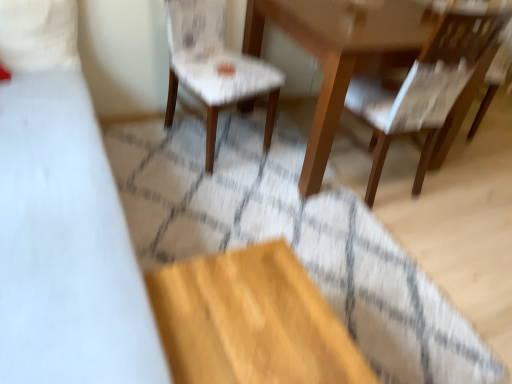
Question: Should I look upward or downward to see matte yellow plywood at lower center?

Choices:
 (A) up
 (B) down

Answer: (B)

Question: Is the depth of matte yellow plywood at lower center greater than that of wooden table at center?

Choices:
 (A) yes
 (B) no

Answer: (B)

Question: Considering the relative sizes of matte yellow plywood at lower center and wooden table at center in the image provided, is matte yellow plywood at lower center taller than wooden table at center?

Choices:
 (A) no
 (B) yes

Answer: (A)

Question: Can you confirm if matte yellow plywood at lower center is bigger than wooden table at center?

Choices:
 (A) yes
 (B) no

Answer: (B)

Question: Considering the relative sizes of matte yellow plywood at lower center and wooden table at center in the image provided, is matte yellow plywood at lower center thinner than wooden table at center?

Choices:
 (A) yes
 (B) no

Answer: (A)

Question: From the image's perspective, is matte yellow plywood at lower center under wooden table at center?

Choices:
 (A) no
 (B) yes

Answer: (B)

Question: Considering the relative positions of matte yellow plywood at lower center and wooden table at center in the image provided, is matte yellow plywood at lower center in front of wooden table at center?

Choices:
 (A) no
 (B) yes

Answer: (B)

Question: Is matte yellow plywood at lower center further to camera compared to white fabric chair at center, which is the first chair from left to right?

Choices:
 (A) no
 (B) yes

Answer: (A)

Question: Is matte yellow plywood at lower center aimed at white fabric chair at center, which is the first chair from left to right?

Choices:
 (A) no
 (B) yes

Answer: (A)

Question: Does matte yellow plywood at lower center appear on the right side of white fabric chair at center, acting as the second chair starting from the right?

Choices:
 (A) no
 (B) yes

Answer: (B)

Question: Is matte yellow plywood at lower center wider than white fabric chair at center, acting as the second chair starting from the right?

Choices:
 (A) yes
 (B) no

Answer: (B)

Question: Does matte yellow plywood at lower center come in front of white fabric chair at center, acting as the second chair starting from the right?

Choices:
 (A) no
 (B) yes

Answer: (B)

Question: Is matte yellow plywood at lower center taller than white fabric chair at center, which is the first chair from left to right?

Choices:
 (A) no
 (B) yes

Answer: (A)

Question: From a real-world perspective, is wooden table at center positioned under white fabric chair at center, acting as the second chair starting from the right, based on gravity?

Choices:
 (A) no
 (B) yes

Answer: (B)